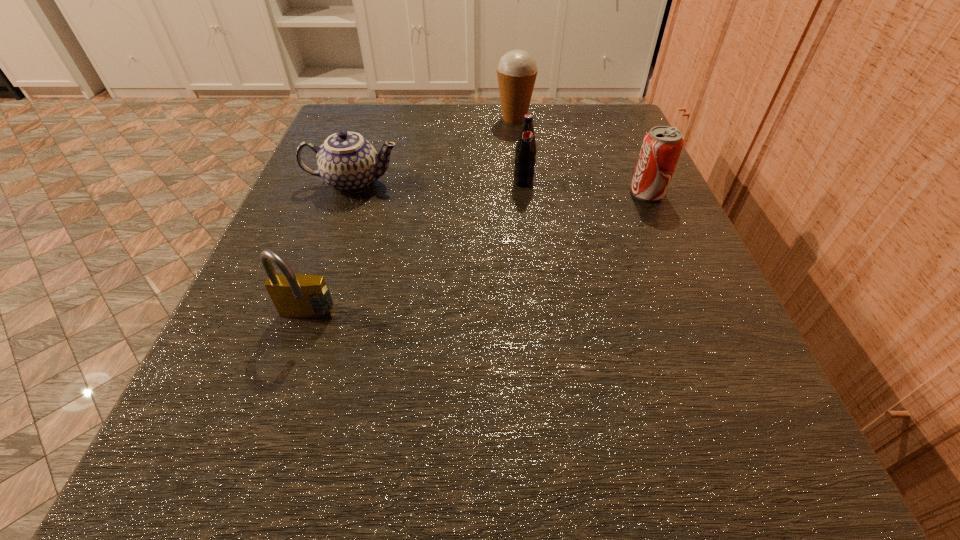
Locate which object ranks second in proximity to the icecream. Please provide its 2D coordinates. Your answer should be formatted as a tuple, i.e. [(x, y)], where the tuple contains the x and y coordinates of a point satisfying the conditions above.

[(347, 162)]

Point out which object is positioned as the fourth nearest to the nearest object. Please provide its 2D coordinates. Your answer should be formatted as a tuple, i.e. [(x, y)], where the tuple contains the x and y coordinates of a point satisfying the conditions above.

[(517, 70)]

Find the location of a particular element. vacant space that satisfies the following two spatial constraints: 1. on the front label of the left soda can; 2. from the spout of the shortest object is located at coordinates (523, 183).

Where is `vacant space that satisfies the following two spatial constraints: 1. on the front label of the left soda can; 2. from the spout of the chinaware`? The height and width of the screenshot is (540, 960). vacant space that satisfies the following two spatial constraints: 1. on the front label of the left soda can; 2. from the spout of the chinaware is located at coordinates (523, 183).

Locate an element on the screen. vacant space that satisfies the following two spatial constraints: 1. from the spout of the shortest object; 2. on the left side of the right soda can is located at coordinates click(349, 193).

Locate an element on the screen. This screenshot has width=960, height=540. free space that satisfies the following two spatial constraints: 1. on the front label of the left soda can; 2. from the spout of the shortest object is located at coordinates (523, 183).